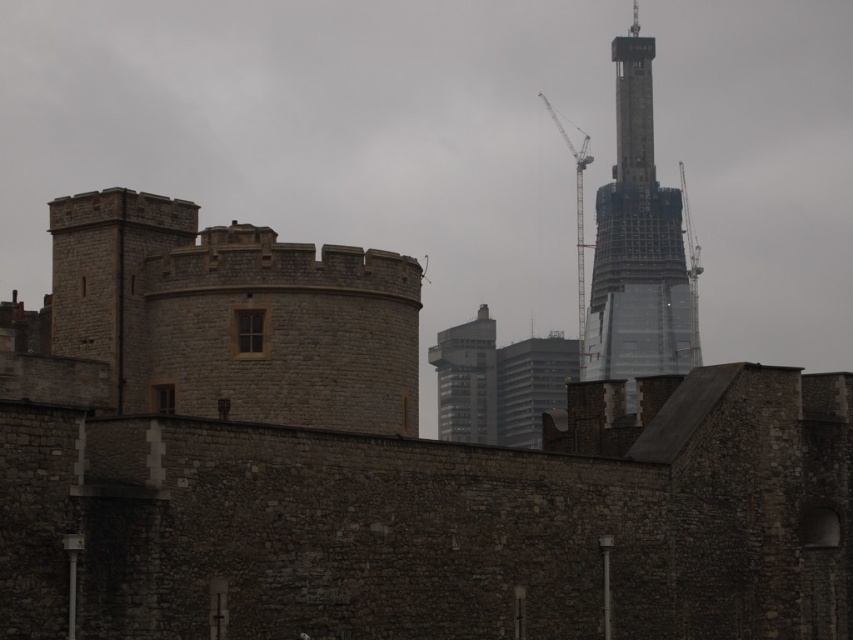
Can you confirm if transparent glass tower at upper right is thinner than metallic gray crane at upper right?

In fact, transparent glass tower at upper right might be wider than metallic gray crane at upper right.

Between point (602, 264) and point (566, 145), which one is positioned in front?

Positioned in front is point (602, 264).

Locate an element on the screen. The width and height of the screenshot is (853, 640). transparent glass tower at upper right is located at coordinates (637, 243).

The height and width of the screenshot is (640, 853). In order to click on transparent glass tower at upper right in this screenshot , I will do `click(637, 243)`.

Consider the image. Can you confirm if glassy reflective skyscraper at center is thinner than metallic gray crane at upper right?

No, glassy reflective skyscraper at center is not thinner than metallic gray crane at upper right.

Is glassy reflective skyscraper at center smaller than metallic gray crane at upper right?

Yes, glassy reflective skyscraper at center is smaller than metallic gray crane at upper right.

Between point (468, 355) and point (577, 264), which one is positioned in front?

Positioned in front is point (468, 355).

Image resolution: width=853 pixels, height=640 pixels. Identify the location of glassy reflective skyscraper at center. tap(466, 380).

The image size is (853, 640). What do you see at coordinates (376, 467) in the screenshot?
I see `stone wall at center` at bounding box center [376, 467].

Does stone wall at center lie behind glassy reflective skyscraper at center?

That is False.

Image resolution: width=853 pixels, height=640 pixels. Describe the element at coordinates (376, 467) in the screenshot. I see `stone wall at center` at that location.

Locate an element on the screen. This screenshot has height=640, width=853. stone wall at center is located at coordinates (376, 467).